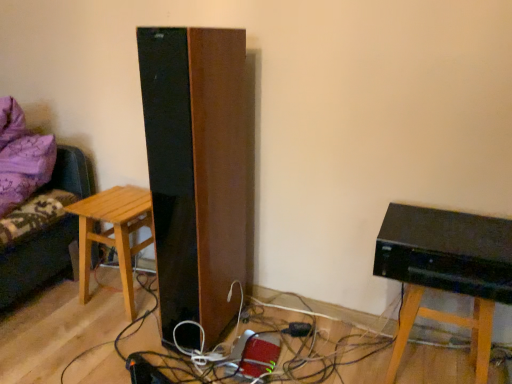
Identify the location of black plastic plug at lower center. (x=298, y=329).

Image resolution: width=512 pixels, height=384 pixels. What do you see at coordinates (39, 209) in the screenshot?
I see `purple fabric couch at left` at bounding box center [39, 209].

Identify the location of light brown wooden stool at left. The image size is (512, 384). (113, 233).

What are the coordinates of `black plastic plug at lower center` in the screenshot? It's located at (298, 329).

How different are the orientations of black plastic plug at lower center and black glossy computer at lower right in degrees?

The facing directions of black plastic plug at lower center and black glossy computer at lower right are 27.8 degrees apart.

Is black plastic plug at lower center shorter than black glossy computer at lower right?

Yes.

Is black plastic plug at lower center far away from black glossy computer at lower right?

Actually, black plastic plug at lower center and black glossy computer at lower right are a little close together.

At what (x,y) coordinates should I click in order to perform the action: click on plug behind the black glossy computer at lower right. Please return your answer as a coordinate pair (x, y). Image resolution: width=512 pixels, height=384 pixels. Looking at the image, I should click on (298, 329).

From the image's perspective, which object appears higher, black glossy computer at lower right or black plastic plug at lower center?

black glossy computer at lower right is shown above in the image.

In terms of height, does black glossy computer at lower right look taller or shorter compared to black plastic plug at lower center?

black glossy computer at lower right is taller than black plastic plug at lower center.

Does black glossy computer at lower right appear on the right side of black plastic plug at lower center?

Yes.

Is purple fabric couch at left beside black glossy computer at lower right?

No, purple fabric couch at left is not in contact with black glossy computer at lower right.

Based on the photo, is purple fabric couch at left inside the boundaries of black glossy computer at lower right, or outside?

purple fabric couch at left is located beyond the bounds of black glossy computer at lower right.

Who is bigger, purple fabric couch at left or black glossy computer at lower right?

Bigger between the two is purple fabric couch at left.

Is purple fabric couch at left looking in the opposite direction of black glossy computer at lower right?

No, purple fabric couch at left's orientation is not away from black glossy computer at lower right.

Which of these two, light brown wooden stool at left or black glossy computer at lower right, is wider?

light brown wooden stool at left.

Is light brown wooden stool at left not within black glossy computer at lower right?

That's correct, light brown wooden stool at left is outside of black glossy computer at lower right.

From the image's perspective, who appears lower, light brown wooden stool at left or black glossy computer at lower right?

From the image's view, black glossy computer at lower right is below.

Does point (90, 252) appear closer or farther from the camera than point (413, 219)?

Clearly, point (90, 252) is more distant from the camera than point (413, 219).

Is light brown wooden stool at left inside the boundaries of black plastic plug at lower center, or outside?

light brown wooden stool at left is not enclosed by black plastic plug at lower center.

From the image's perspective, is light brown wooden stool at left beneath black plastic plug at lower center?

No, from the image's perspective, light brown wooden stool at left is not beneath black plastic plug at lower center.

From a real-world perspective, who is located lower, light brown wooden stool at left or black plastic plug at lower center?

black plastic plug at lower center.

Can you confirm if light brown wooden stool at left is wider than black plastic plug at lower center?

Correct, the width of light brown wooden stool at left exceeds that of black plastic plug at lower center.

Considering the points (294, 322) and (83, 201), which point is behind, point (294, 322) or point (83, 201)?

Positioned behind is point (83, 201).

Consider the image. Can you tell me how much black plastic plug at lower center and light brown wooden stool at left differ in facing direction?

The facing directions of black plastic plug at lower center and light brown wooden stool at left are 33.7 degrees apart.

Which object is wider, black plastic plug at lower center or light brown wooden stool at left?

Wider between the two is light brown wooden stool at left.

In the scene shown: Does black plastic plug at lower center come in front of light brown wooden stool at left?

No, black plastic plug at lower center is further to the viewer.

From the picture: Considering the relative sizes of black glossy computer at lower right and light brown wooden stool at left in the image provided, is black glossy computer at lower right shorter than light brown wooden stool at left?

Correct, black glossy computer at lower right is not as tall as light brown wooden stool at left.

Could you tell me if black glossy computer at lower right is facing light brown wooden stool at left?

No, black glossy computer at lower right is not facing towards light brown wooden stool at left.

In the scene shown: Considering the sizes of objects black glossy computer at lower right and light brown wooden stool at left in the image provided, who is wider, black glossy computer at lower right or light brown wooden stool at left?

Wider between the two is light brown wooden stool at left.

Is black glossy computer at lower right bigger or smaller than light brown wooden stool at left?

Considering their sizes, black glossy computer at lower right takes up less space than light brown wooden stool at left.

Find the location of `plug on the left of black glossy computer at lower right`. plug on the left of black glossy computer at lower right is located at coordinates point(298,329).

Where is `plug beneath the black glossy computer at lower right (from a real-world perspective)`? The width and height of the screenshot is (512, 384). plug beneath the black glossy computer at lower right (from a real-world perspective) is located at coordinates (298, 329).

Based on their spatial positions, is black plastic plug at lower center or purple fabric couch at left further from light brown wooden stool at left?

The object further to light brown wooden stool at left is black plastic plug at lower center.

Looking at this image, from the image, which object appears to be farther from black plastic plug at lower center, light brown wooden stool at left or black glossy computer at lower right?

light brown wooden stool at left is further to black plastic plug at lower center.

Which object lies further to the anchor point light brown wooden stool at left, purple fabric couch at left or black glossy computer at lower right?

Among the two, black glossy computer at lower right is located further to light brown wooden stool at left.

Looking at the image, which one is located closer to black glossy computer at lower right, purple fabric couch at left or black plastic plug at lower center?

black plastic plug at lower center lies closer to black glossy computer at lower right than the other object.

From the image, which object appears to be farther from purple fabric couch at left, black glossy computer at lower right or light brown wooden stool at left?

Among the two, black glossy computer at lower right is located further to purple fabric couch at left.

Looking at this image, considering their positions, is light brown wooden stool at left positioned further to purple fabric couch at left than black glossy computer at lower right?

black glossy computer at lower right is further to purple fabric couch at left.

Based on their spatial positions, is black glossy computer at lower right or black plastic plug at lower center further from light brown wooden stool at left?

Among the two, black glossy computer at lower right is located further to light brown wooden stool at left.

Considering their positions, is light brown wooden stool at left positioned further to black plastic plug at lower center than purple fabric couch at left?

The object further to black plastic plug at lower center is purple fabric couch at left.

Image resolution: width=512 pixels, height=384 pixels. I want to click on stool between purple fabric couch at left and black glossy computer at lower right in the horizontal direction, so click(x=113, y=233).

What are the coordinates of `plug between light brown wooden stool at left and black glossy computer at lower right in the horizontal direction` in the screenshot? It's located at (298, 329).

The image size is (512, 384). I want to click on plug located between purple fabric couch at left and black glossy computer at lower right in the left-right direction, so click(x=298, y=329).

This screenshot has width=512, height=384. I want to click on stool situated between purple fabric couch at left and black plastic plug at lower center from left to right, so click(113, 233).